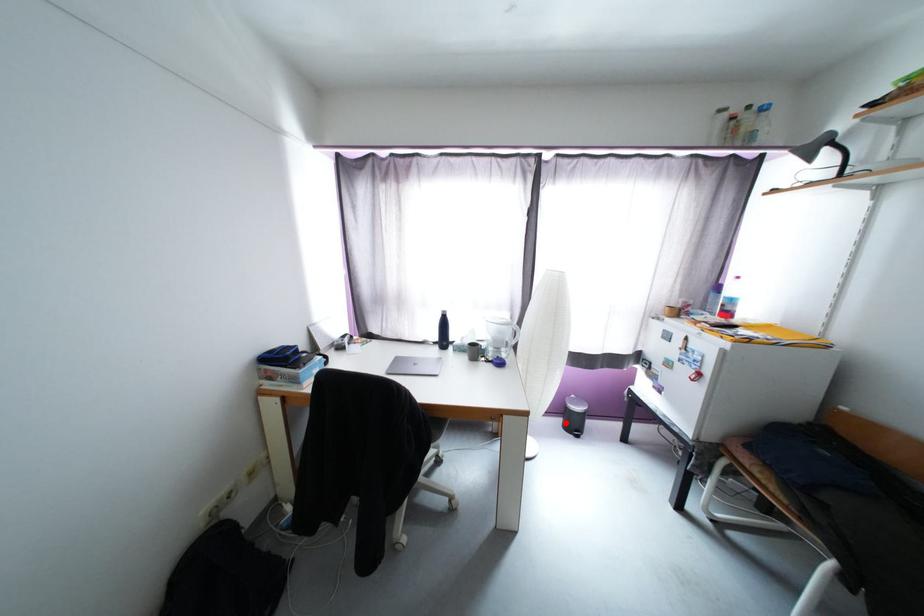
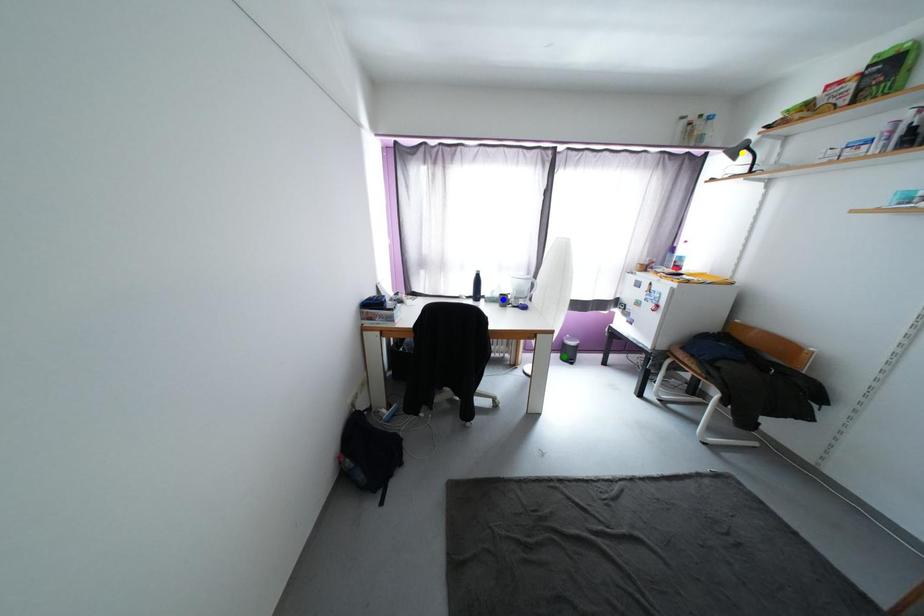
Question: I am providing you with two images of the same scene from different viewpoints. A red point is marked on the first image. You are given multiple points on the second image. In image 2, which mark is for the same physical point as the one in image 1?

Choices:
 (A) yellow point
 (B) blue point
 (C) green point

Answer: (C)